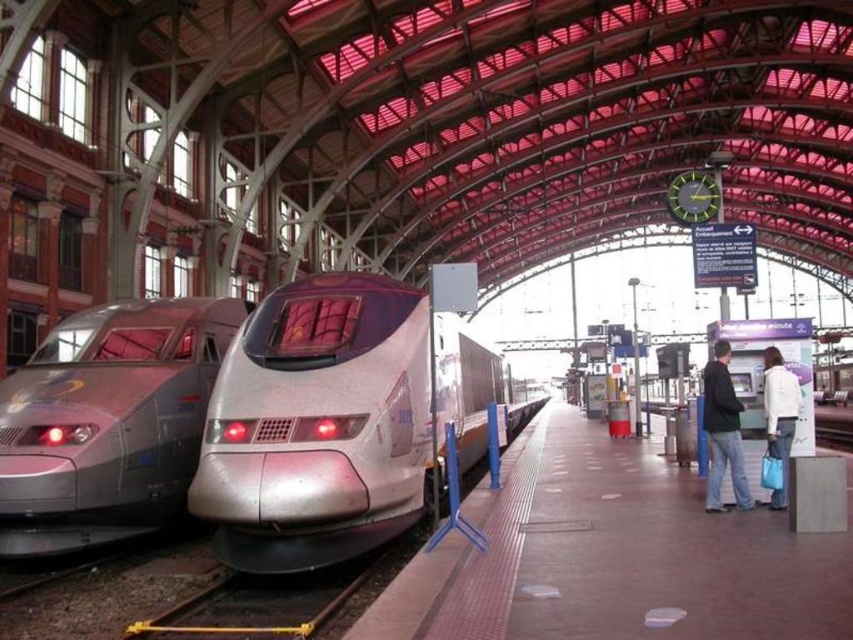
Does sleek silver train at center have a lesser width compared to dark blue jeans at right?

Incorrect, sleek silver train at center's width is not less than dark blue jeans at right's.

Is point (248, 368) positioned after point (734, 448)?

No.

Identify the location of sleek silver train at center. This screenshot has width=853, height=640. (331, 422).

Can you confirm if brown smooth platform at center is positioned to the right of sleek silver train at left?

Indeed, brown smooth platform at center is positioned on the right side of sleek silver train at left.

Which of these two, brown smooth platform at center or sleek silver train at left, stands taller?

With more height is sleek silver train at left.

Measure the distance between point (805, 602) and camera.

A distance of 13.17 meters exists between point (805, 602) and camera.

Find the location of `brown smooth platform at center`. brown smooth platform at center is located at coordinates (612, 556).

Does point (699, 630) come farther from viewer compared to point (720, 401)?

That is False.

Is point (631, 492) in front of point (738, 486)?

No, it is not.

Where is `brown smooth platform at center`? The width and height of the screenshot is (853, 640). brown smooth platform at center is located at coordinates (612, 556).